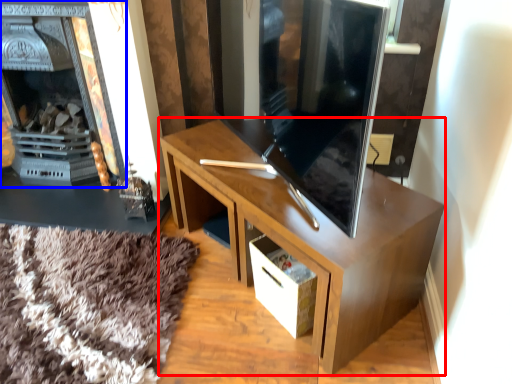
Question: Which object appears farthest to the camera in this image, desk (highlighted by a red box) or fireplace (highlighted by a blue box)?

Choices:
 (A) desk
 (B) fireplace

Answer: (B)